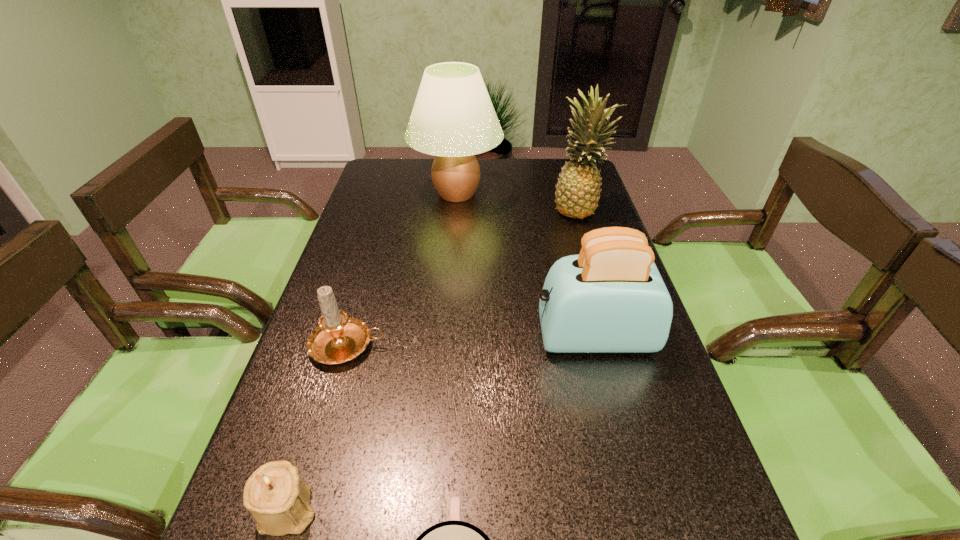
Identify the location of free point located on the front of the candle. (315, 459).

At what (x,y) coordinates should I click in order to perform the action: click on blank space located 0.340m on the back of the candle_holder. Please return your answer as a coordinate pair (x, y). Looking at the image, I should click on (343, 332).

You are a GUI agent. You are given a task and a screenshot of the screen. Output one action in this format:
    pyautogui.click(x=<x>, y=<y>)
    Task: Click on the object present at the far edge
    The width and height of the screenshot is (960, 540).
    Given the screenshot: What is the action you would take?
    pyautogui.click(x=453, y=118)

The image size is (960, 540). Identify the location of candle that is positioned at the left edge. (338, 338).

The image size is (960, 540). I want to click on candle_holder that is at the left edge, so click(x=278, y=500).

Locate an element on the screen. pineapple that is at the right edge is located at coordinates (577, 192).

Identify the location of toaster that is at the right edge. (610, 298).

In the image, there is a desktop. Identify the location of vacant space at the far edge. The width and height of the screenshot is (960, 540). (526, 158).

What are the coordinates of `vacant space at the left edge of the desktop` in the screenshot? It's located at (276, 406).

Image resolution: width=960 pixels, height=540 pixels. In order to click on vacant area at the far left corner in this screenshot , I will do `click(398, 167)`.